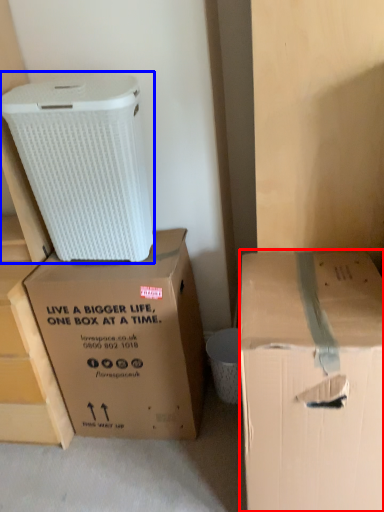
Question: Which of the following is the closest to the observer, box (highlighted by a red box) or cardboard box (highlighted by a blue box)?

Choices:
 (A) box
 (B) cardboard box

Answer: (A)